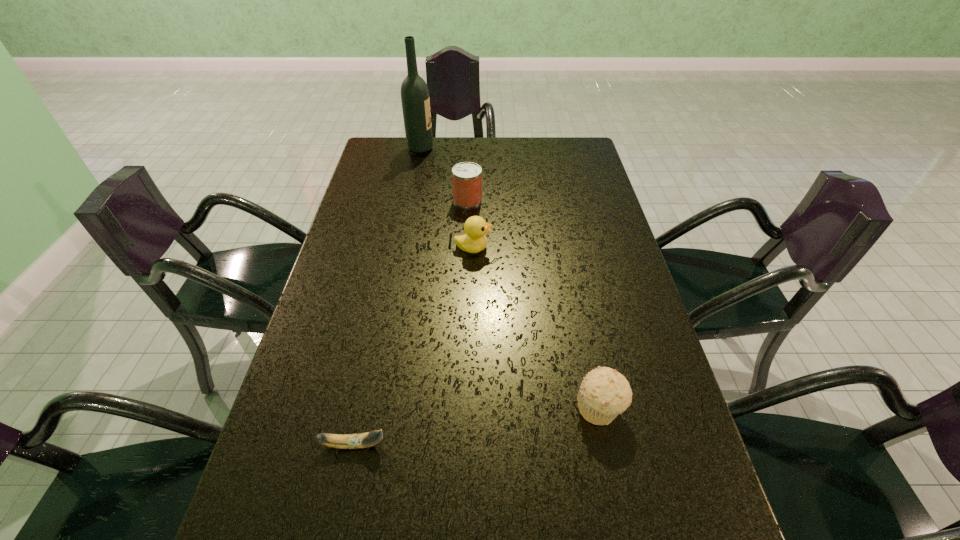
Find the location of a particular element. The width and height of the screenshot is (960, 540). free space located 0.250m on the face of the third nearest object is located at coordinates (578, 248).

Image resolution: width=960 pixels, height=540 pixels. Identify the location of blank space located on the back of the muffin. (580, 309).

Identify the location of vacant space located 0.340m at the stem of the shortest object. This screenshot has width=960, height=540. (562, 444).

At what (x,y) coordinates should I click in order to perform the action: click on object that is at the far edge. Please return your answer as a coordinate pair (x, y). The width and height of the screenshot is (960, 540). Looking at the image, I should click on (415, 99).

Identify the location of wine bottle present at the left edge. The image size is (960, 540). (415, 99).

You are a GUI agent. You are given a task and a screenshot of the screen. Output one action in this format:
    pyautogui.click(x=<x>, y=<y>)
    Task: Click on the banana at the left edge
    The width and height of the screenshot is (960, 540).
    Given the screenshot: What is the action you would take?
    pyautogui.click(x=362, y=440)

The width and height of the screenshot is (960, 540). In order to click on object that is at the right edge in this screenshot , I will do `click(604, 393)`.

You are a GUI agent. You are given a task and a screenshot of the screen. Output one action in this format:
    pyautogui.click(x=<x>, y=<y>)
    Task: Click on the object situated at the far left corner
    The height and width of the screenshot is (540, 960).
    Given the screenshot: What is the action you would take?
    pyautogui.click(x=415, y=99)

The height and width of the screenshot is (540, 960). I want to click on free space at the far edge of the desktop, so click(535, 149).

In the image, there is a desktop. Where is `free space at the left edge`? free space at the left edge is located at coordinates (363, 384).